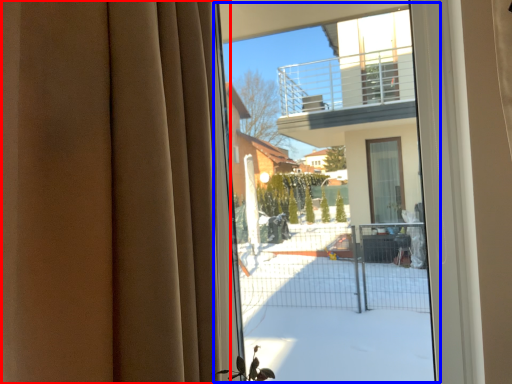
Question: Which object is closer to the camera taking this photo, curtain (highlighted by a red box) or bay window (highlighted by a blue box)?

Choices:
 (A) curtain
 (B) bay window

Answer: (A)